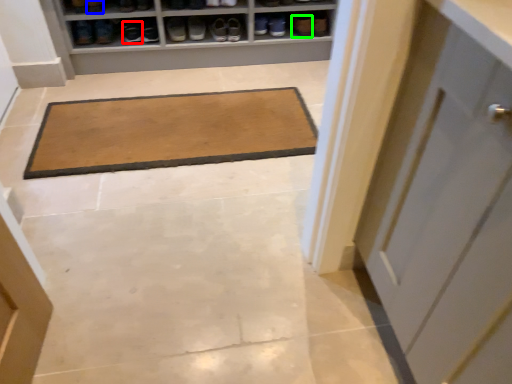
Question: Estimate the real-world distances between objects in this image. Which object is closer to footwear (highlighted by a red box), shoe (highlighted by a blue box) or shoe (highlighted by a green box)?

Choices:
 (A) shoe
 (B) shoe

Answer: (A)